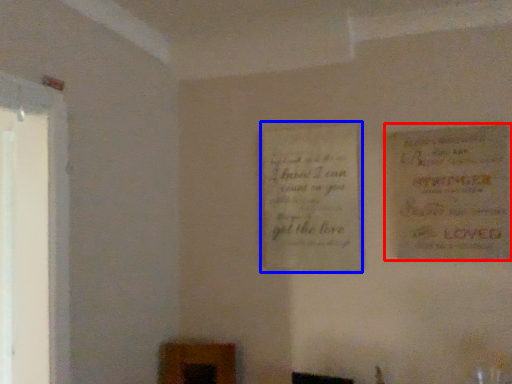
Question: Which point is further to the camera, poster (highlighted by a red box) or poster (highlighted by a blue box)?

Choices:
 (A) poster
 (B) poster

Answer: (B)